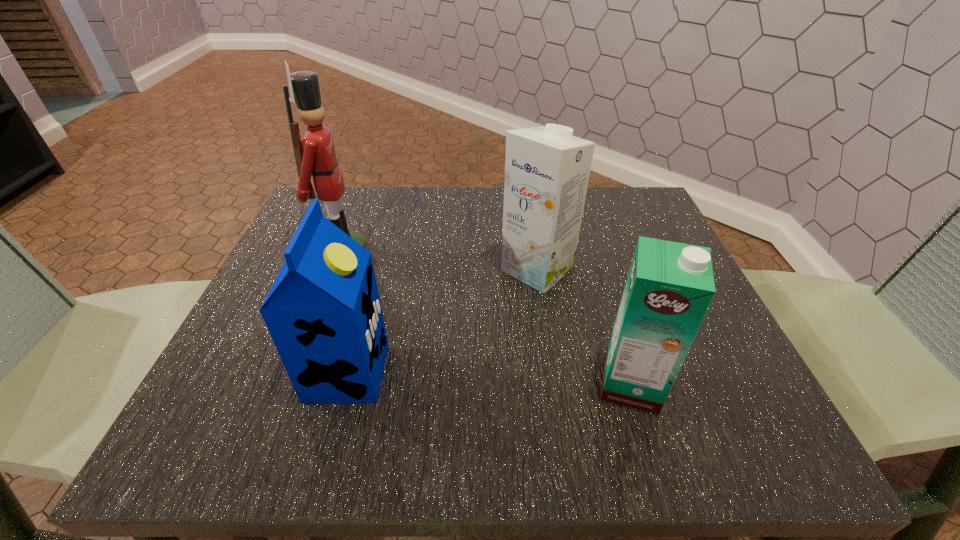
I want to click on vacant space that satisfies the following two spatial constraints: 1. on the front side of the farthest carton; 2. with the cap open on the leftmost carton, so click(553, 372).

Locate an element on the screen. This screenshot has height=540, width=960. vacant region that satisfies the following two spatial constraints: 1. on the back side of the farthest carton; 2. on the front-facing side of the tallest object is located at coordinates (536, 255).